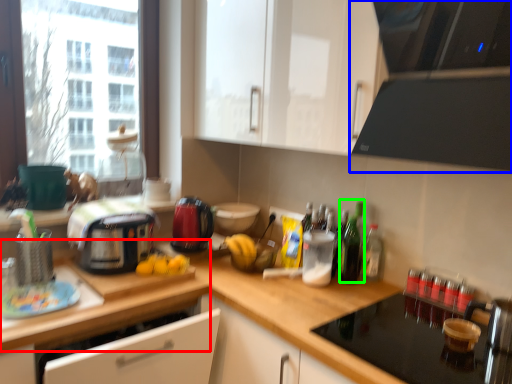
Question: Which object is the farthest from countertop (highlighted by a red box)? Choose among these: home appliance (highlighted by a blue box) or bottle (highlighted by a green box).

Choices:
 (A) home appliance
 (B) bottle

Answer: (A)